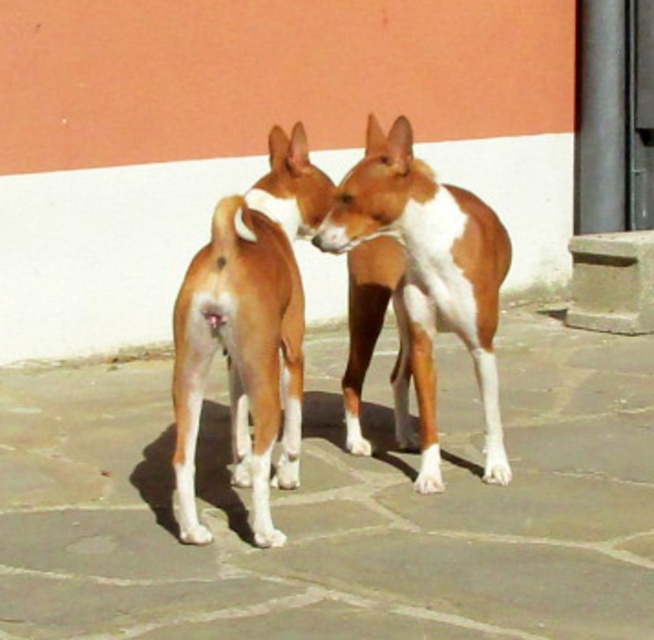
Question: From the image, what is the correct spatial relationship of brown/white fur dog at center in relation to brown smooth dog at center?

Choices:
 (A) above
 (B) below

Answer: (B)

Question: Among these points, which one is nearest to the camera?

Choices:
 (A) (404, 241)
 (B) (254, 504)
 (C) (20, 468)

Answer: (B)

Question: Is brown/white fur dog at center positioned in front of brown smooth dog at center?

Choices:
 (A) no
 (B) yes

Answer: (B)

Question: Is brown stone pavement at center positioned before brown/white fur dog at center?

Choices:
 (A) yes
 (B) no

Answer: (A)

Question: Which object appears farthest from the camera in this image?

Choices:
 (A) brown stone pavement at center
 (B) brown/white fur dog at center

Answer: (B)

Question: Which of the following is the closest to the observer?

Choices:
 (A) brown smooth dog at center
 (B) brown/white fur dog at center

Answer: (B)